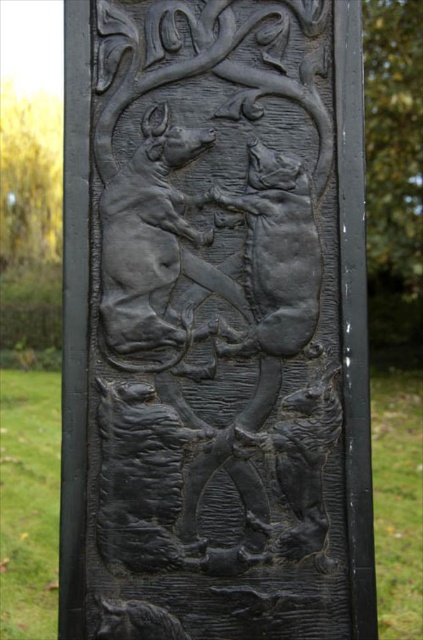
Who is higher up, black matte relief at center or green leafy tree at upper right?

green leafy tree at upper right

From the picture: Who is more forward, (109, 355) or (414, 156)?

Positioned in front is point (109, 355).

Is point (332, 250) positioned behind point (411, 340)?

No, it is not.

At what (x,y) coordinates should I click in order to perform the action: click on black matte relief at center. Please return your answer as a coordinate pair (x, y). The image size is (423, 640). Looking at the image, I should click on (214, 324).

Can you confirm if green leafy tree at upper right is shorter than yellow-green leaves at upper left?

No, green leafy tree at upper right is not shorter than yellow-green leaves at upper left.

Based on the photo, which is more to the left, green leafy tree at upper right or yellow-green leaves at upper left?

yellow-green leaves at upper left is more to the left.

Image resolution: width=423 pixels, height=640 pixels. I want to click on green leafy tree at upper right, so click(393, 173).

Where is `green leafy tree at upper right`? The width and height of the screenshot is (423, 640). green leafy tree at upper right is located at coordinates (393, 173).

Between black matte relief at center and yellow-green leaves at upper left, which one is positioned higher?

yellow-green leaves at upper left

Can you confirm if black matte relief at center is bigger than yellow-green leaves at upper left?

Yes.

What do you see at coordinates (214, 324) in the screenshot?
I see `black matte relief at center` at bounding box center [214, 324].

Locate an element on the screen. This screenshot has height=640, width=423. black matte relief at center is located at coordinates (214, 324).